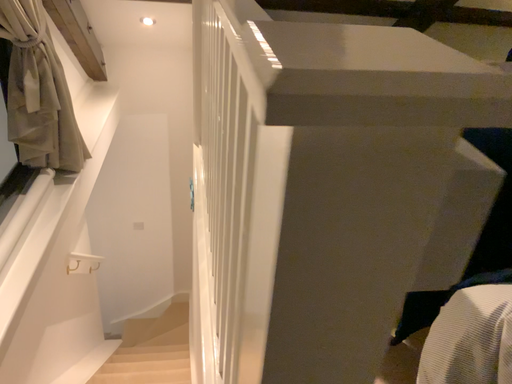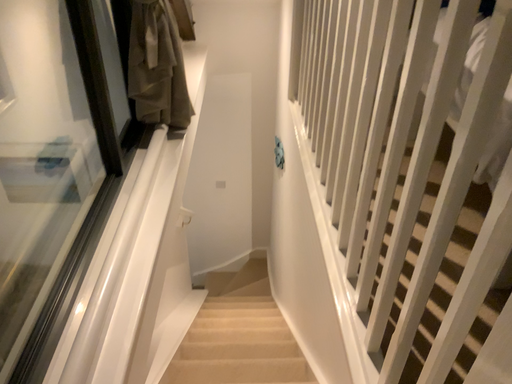
Question: How did the camera likely rotate when shooting the video?

Choices:
 (A) rotated left
 (B) rotated right

Answer: (A)